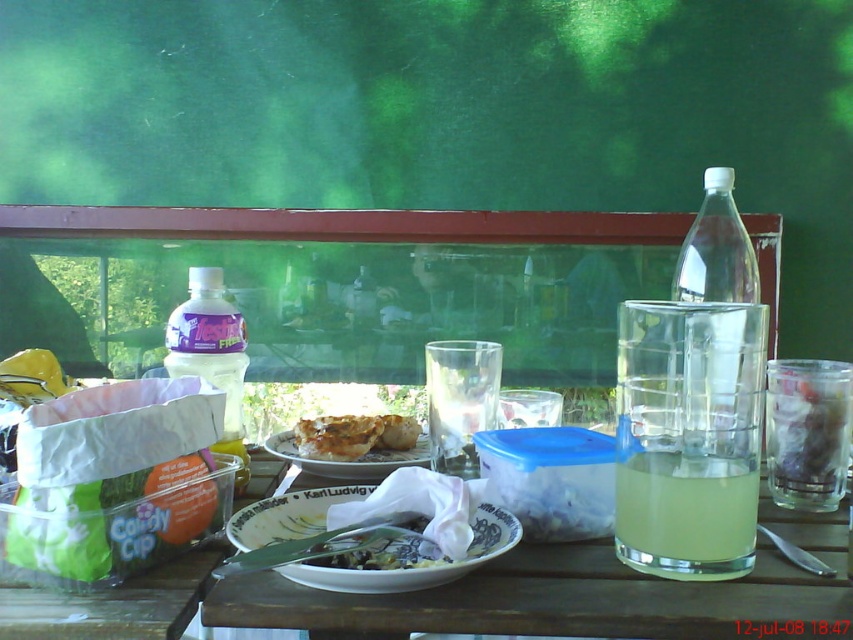
Question: Is yellow translucent glass at right closer to camera compared to white matte plate at center?

Choices:
 (A) no
 (B) yes

Answer: (B)

Question: Does yellow translucent glass at right appear on the left side of translucent plastic bottle at left?

Choices:
 (A) no
 (B) yes

Answer: (A)

Question: Among these points, which one is farthest from the camera?

Choices:
 (A) (636, 480)
 (B) (759, 320)

Answer: (A)

Question: Is white paper plate at center below clear plastic bottle at right?

Choices:
 (A) no
 (B) yes

Answer: (B)

Question: Estimate the real-world distances between objects in this image. Which object is farther from the white paper plate at center?

Choices:
 (A) golden brown flaky pastry at center
 (B) translucent plastic bottle at left
 (C) clear plastic bottle at right

Answer: (C)

Question: Which object appears farthest from the camera in this image?

Choices:
 (A) white matte plate at center
 (B) translucent yellow liquid at table center
 (C) translucent plastic bottle at left
 (D) white paper plate at center

Answer: (A)